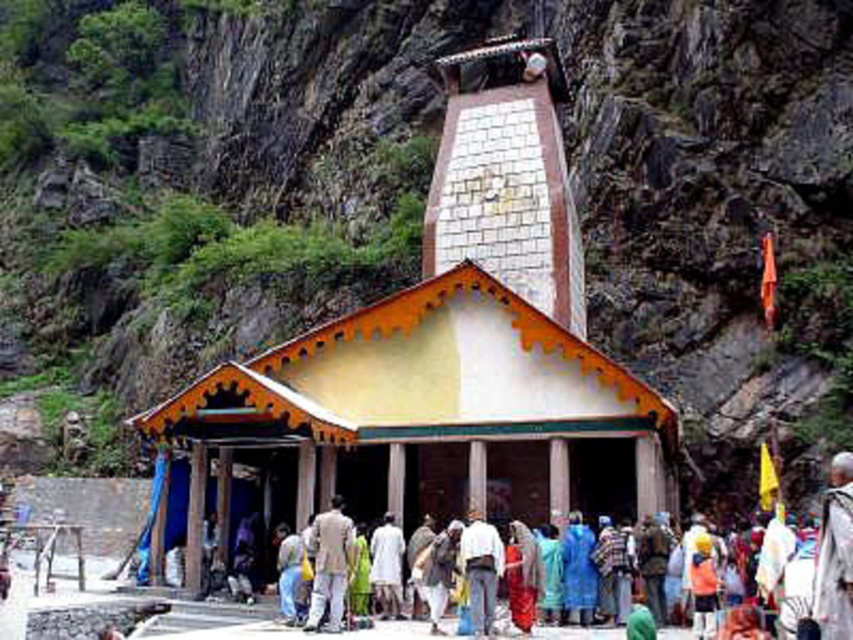
You are standing at point (447, 352) in the temple area. Can you see the entrance of the temple from your current position?

The white stone temple at center is located at point (447, 352), so if you are standing at that point, you are at the temple itself. Therefore, you would be inside the temple and not able to see its entrance from there.

You are standing in front of the temple and want to take a photo. You notice two points marked in the scene. The first point is at coordinates point (477, 150), and the second is at point (349, 544). Which point is closer to your camera lens when taking the photo?

Point (349, 544) is closer to the camera lens because the description states that point (477, 150) is further away than point (349, 544).